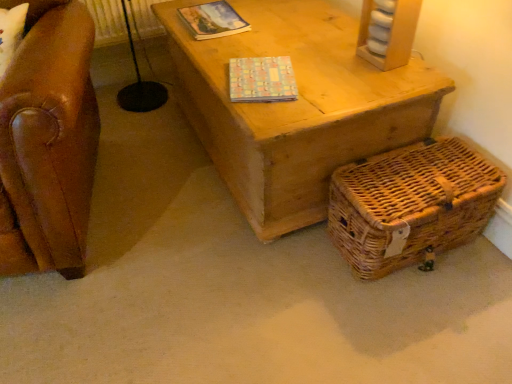
The width and height of the screenshot is (512, 384). In order to click on free space in front of woven brown basket at lower right in this screenshot , I will do `click(419, 326)`.